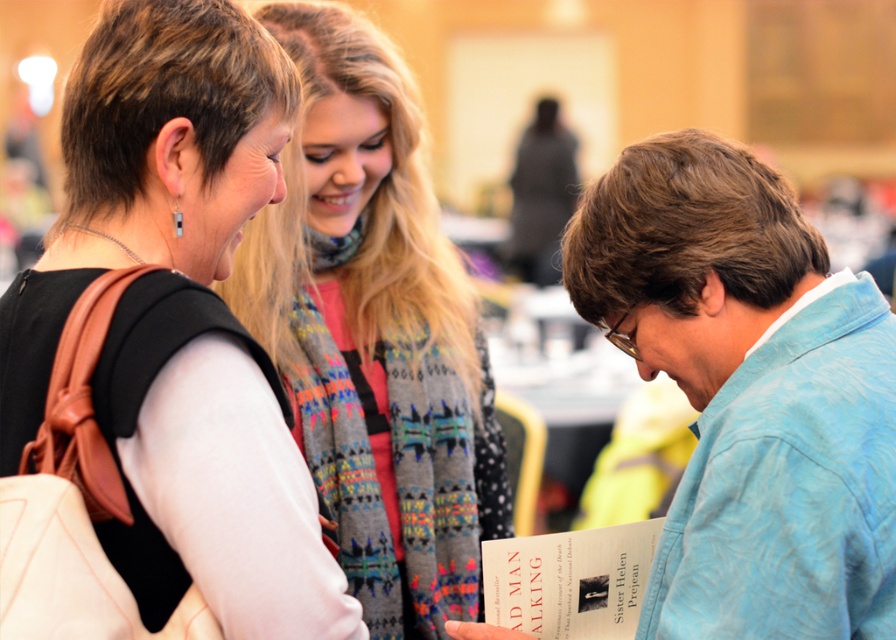
Consider the image. You are organizing a clothing donation drive and need to categorize items by size. You have two items to sort today. The first is a blue textured shirt at lower right and the second is a white sweater at center. Which of these two items is smaller in size?

The blue textured shirt at lower right is smaller in size compared to the white sweater at center.

You are organizing a small book club event and need to place a decorative tablecloth between the white sweater at center and the matte paper book at lower right. The tablecloth is 1.2 meters long. Will it be long enough to cover the space between them?

The distance between the white sweater at center and the matte paper book at lower right is 1.08 meters. Since the tablecloth is 1.2 meters long, it is longer than the required distance. Therefore, the tablecloth will be long enough to cover the space between them.

You are organizing a photo album and want to ensure the order of the objects in the image matches their positions. Which object is closer to the viewer, the matte black top at upper left or the matte paper book at lower right?

The matte black top at upper left is closer to the viewer as it is in front of the matte paper book at lower right.